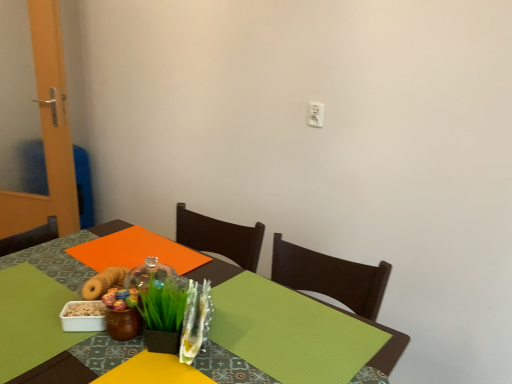
Locate an element on the screen. blank space to the left of green leafy grass at center is located at coordinates (x=94, y=359).